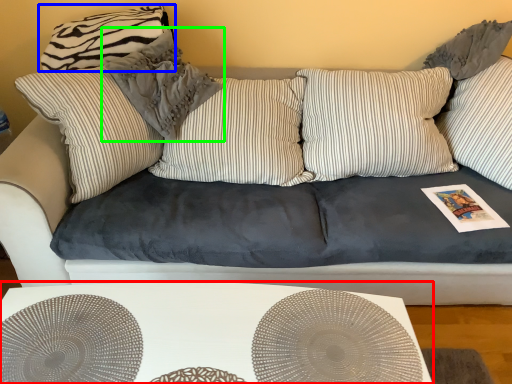
Question: Considering the real-world distances, which object is farthest from table (highlighted by a red box)? pillow (highlighted by a blue box) or pillow (highlighted by a green box)?

Choices:
 (A) pillow
 (B) pillow

Answer: (A)